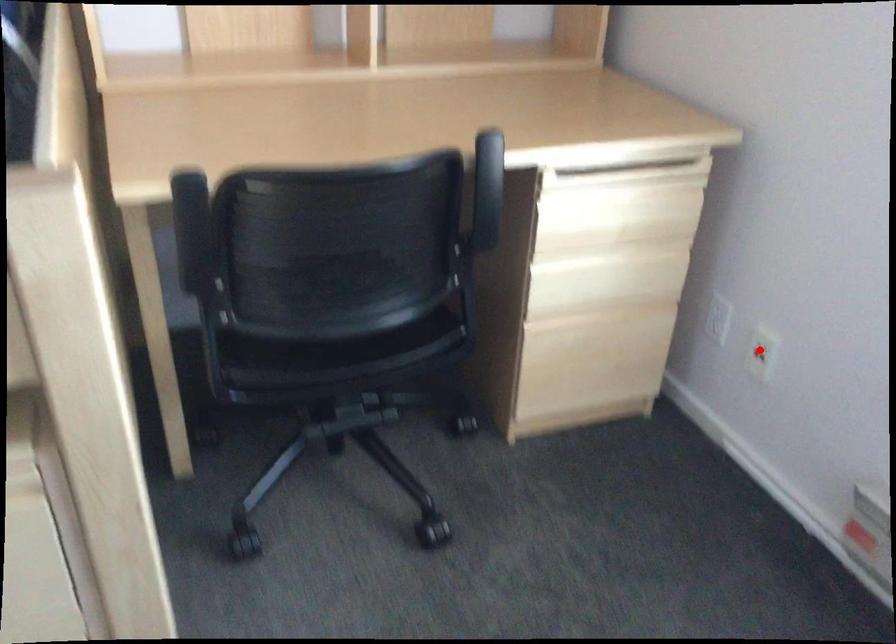
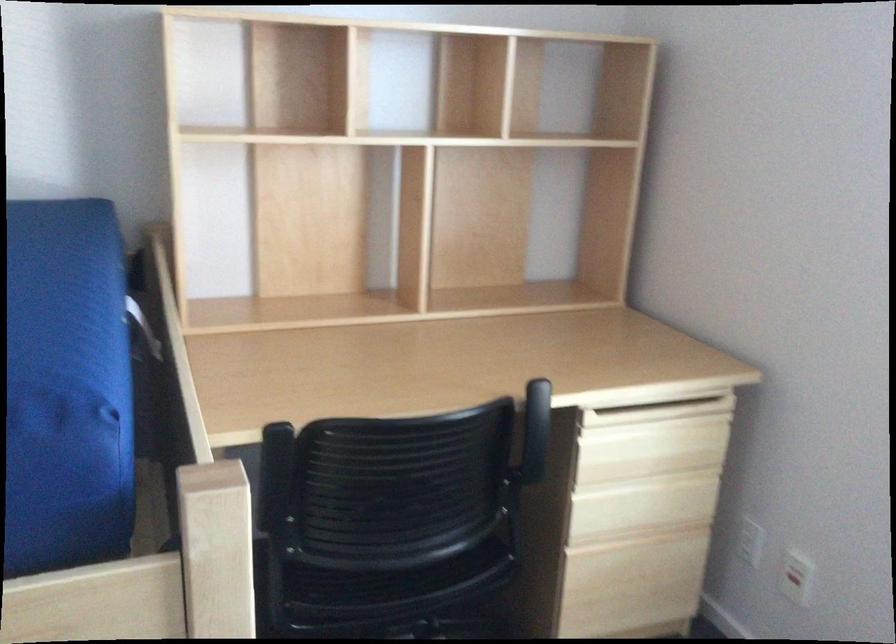
Find the pixel in the second image that matches the highlighted location in the first image.

(796, 576)